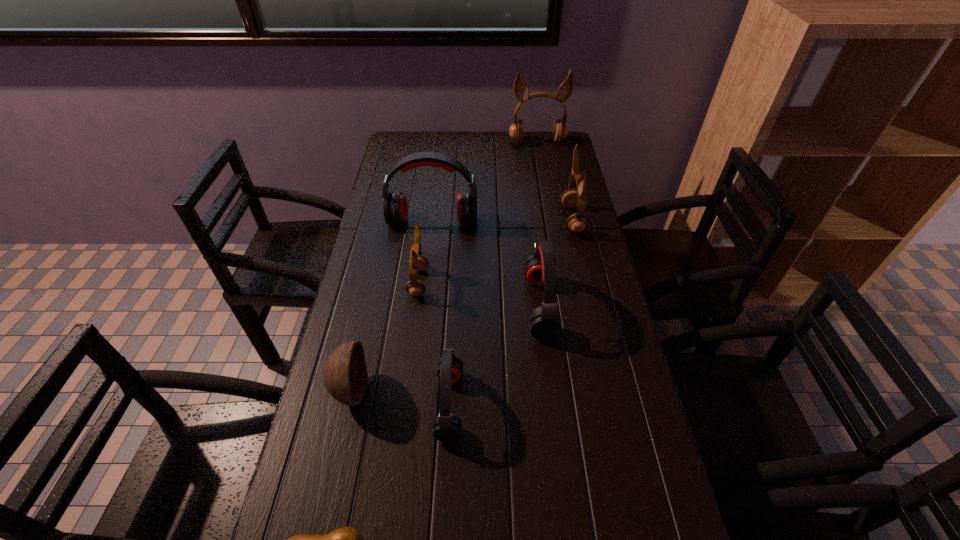
The image size is (960, 540). In order to click on vacant space in between the rightmost red earphone and the farthest brown earphone in this screenshot , I will do `click(539, 224)`.

Locate an element on the screen. empty location between the bowl and the nearest earphone is located at coordinates (400, 397).

Find the location of `free space between the bowl and the farthest red earphone`. free space between the bowl and the farthest red earphone is located at coordinates (392, 306).

I want to click on empty space between the nearest earphone and the farthest object, so click(x=493, y=273).

Locate an element on the screen. object that can be found as the sixth closest to the nearest red earphone is located at coordinates (571, 198).

Point out which object is positioned as the fourth nearest to the shortest object. Please provide its 2D coordinates. Your answer should be formatted as a tuple, i.e. [(x, y)], where the tuple contains the x and y coordinates of a point satisfying the conditions above.

[(414, 287)]

Choose which earphone is the second nearest neighbor to the shortest object. Please provide its 2D coordinates. Your answer should be formatted as a tuple, i.e. [(x, y)], where the tuple contains the x and y coordinates of a point satisfying the conditions above.

[(545, 321)]

Identify the location of the fourth closest earphone to the tallest earphone. The width and height of the screenshot is (960, 540). (414, 287).

The image size is (960, 540). What are the coordinates of `the closest brown earphone to the second smallest red earphone` in the screenshot? It's located at (571, 198).

Identify the location of brown earphone identified as the closest to the bowl. This screenshot has height=540, width=960. (414, 287).